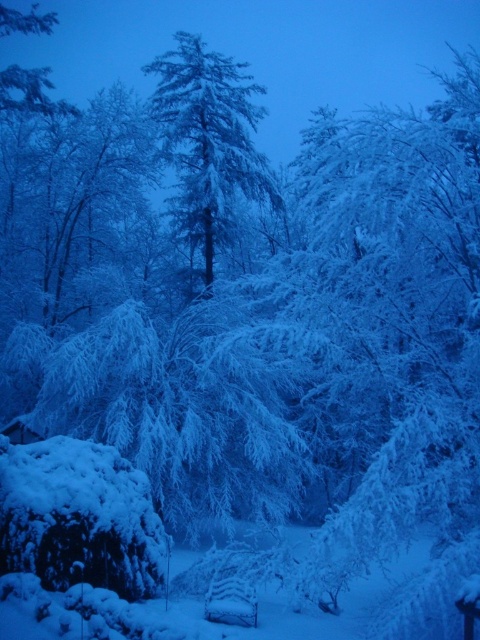
Who is more distant from viewer, (211, 241) or (228, 596)?

Positioned behind is point (211, 241).

Can you confirm if snow-covered evergreen tree at center is bigger than wooden park bench at center?

Yes.

Between point (179, 140) and point (253, 596), which one is positioned in front?

Point (253, 596)

I want to click on snow-covered evergreen tree at center, so click(210, 136).